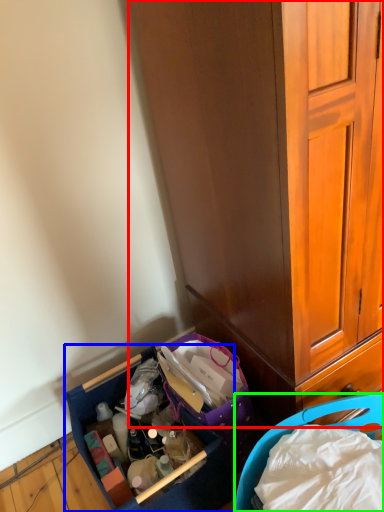
Question: Which object is the farthest from cabinetry (highlighted by a red box)? Choose among these: picnic basket (highlighted by a blue box) or picnic basket (highlighted by a green box).

Choices:
 (A) picnic basket
 (B) picnic basket

Answer: (A)